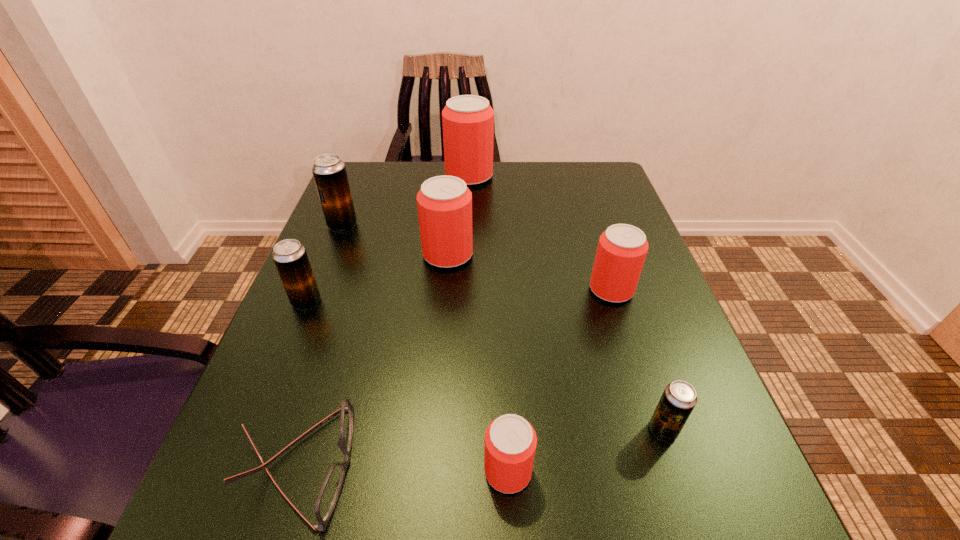
I want to click on the closest black beer can relative to the biggest red beer can, so click(x=329, y=171).

Locate which black beer can ranks third in proximity to the spectacles. Please provide its 2D coordinates. Your answer should be formatted as a tuple, i.e. [(x, y)], where the tuple contains the x and y coordinates of a point satisfying the conditions above.

[(329, 171)]

The height and width of the screenshot is (540, 960). I want to click on vacant space that satisfies the following two spatial constraints: 1. on the back side of the biggest black beer can; 2. on the right side of the second farthest black beer can, so click(x=338, y=225).

Find the location of a particular element. vacant space that satisfies the following two spatial constraints: 1. on the front side of the second nearest red beer can; 2. on the front-facing side of the spectacles is located at coordinates (667, 464).